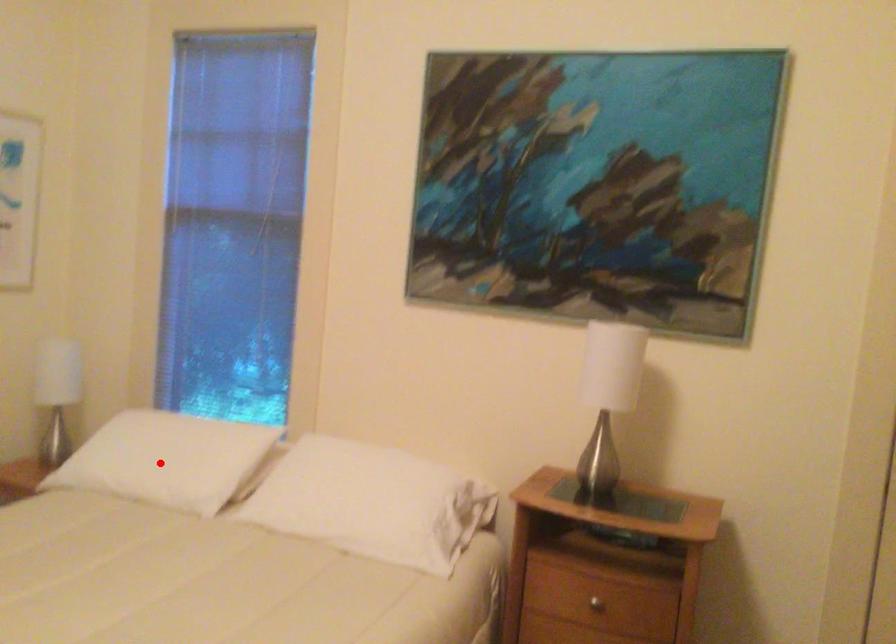
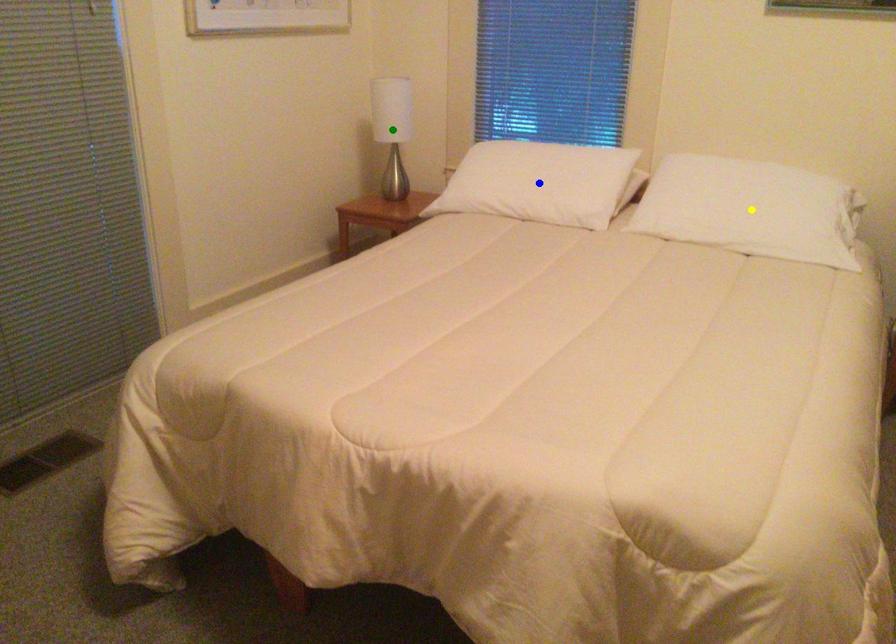
Question: I am providing you with two images of the same scene from different viewpoints. A red point is marked on the first image. You are given multiple points on the second image. Can you choose the point in image 2 that corresponds to the point in image 1?

Choices:
 (A) green point
 (B) yellow point
 (C) blue point

Answer: (C)